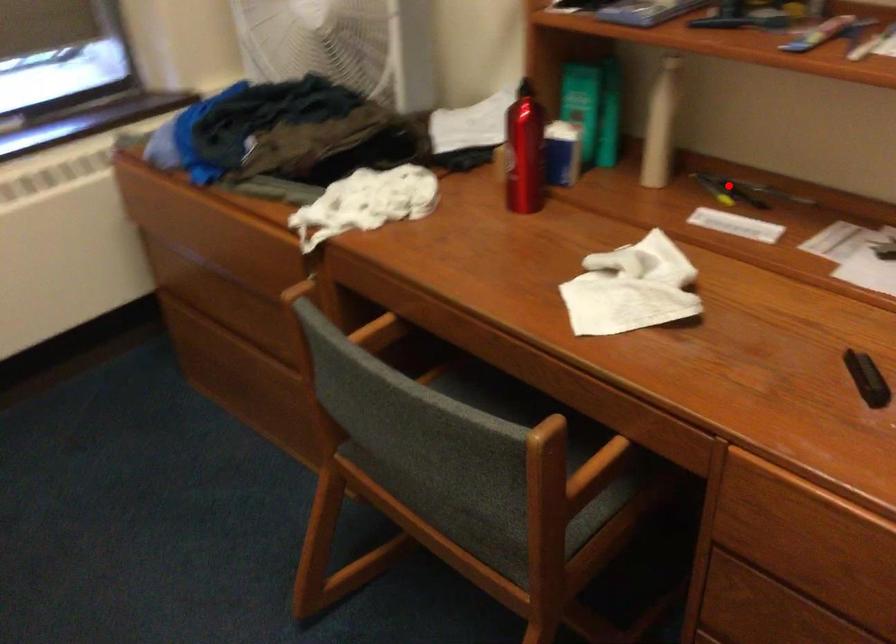
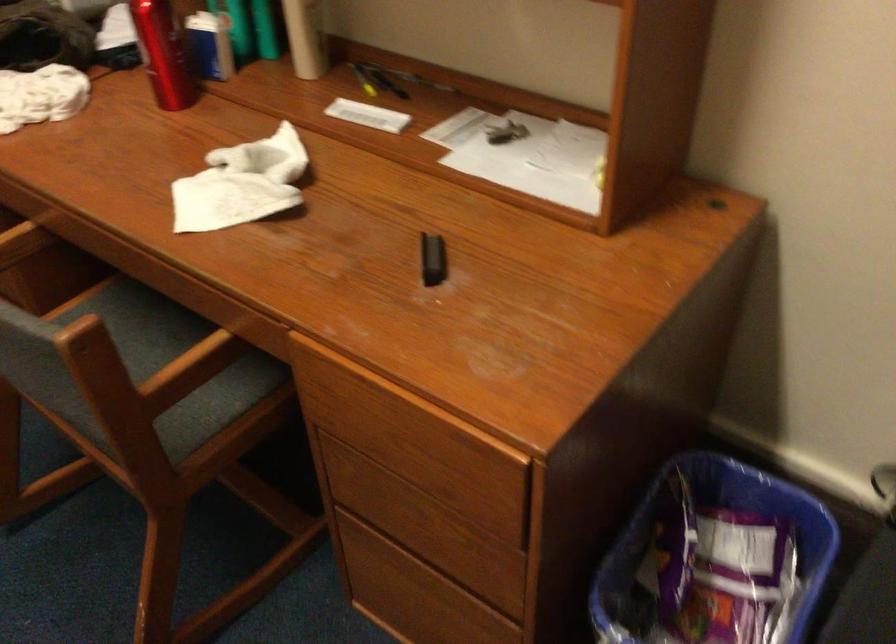
Where in the second image is the point corresponding to the highlighted location from the first image?

(376, 80)